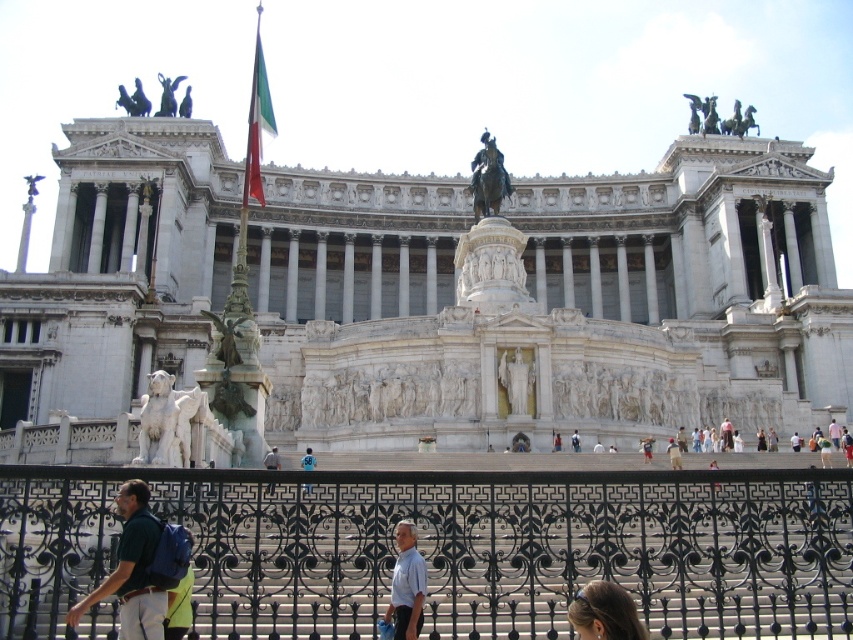
You are a tour guide explaining the layout of the monument to a group. You mention both the bronze statue at center and the bronze statue at upper left. Which one is positioned lower in the scene?

The bronze statue at center is positioned lower than the bronze statue at upper left.

You are standing in front of the monument and want to take a photo. You notice two points marked as point 1 at coordinates (503,177) and point 2 at (167,92). Which point is closer to your camera position?

Point 1 at coordinates (503,177) is closer to the camera than point 2 at (167,92).